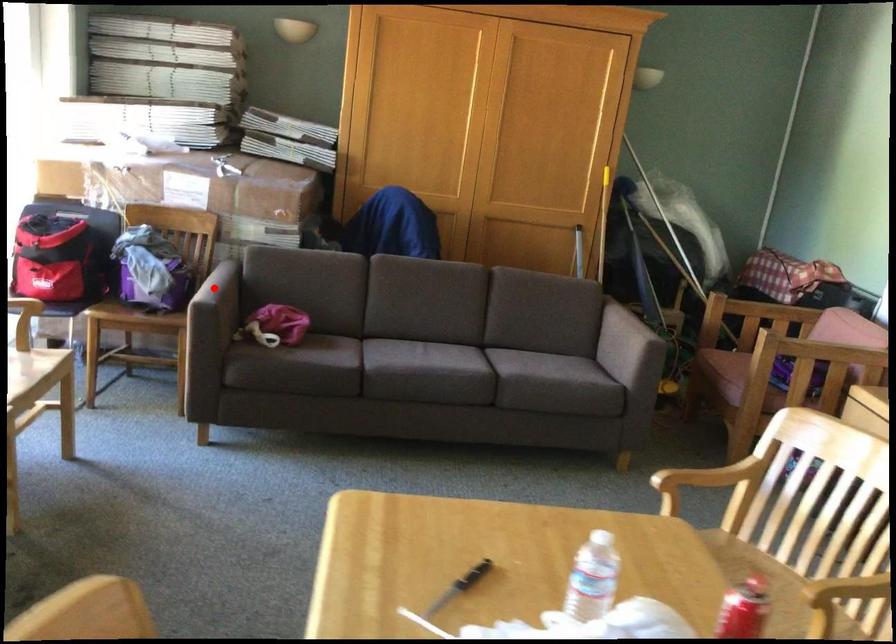
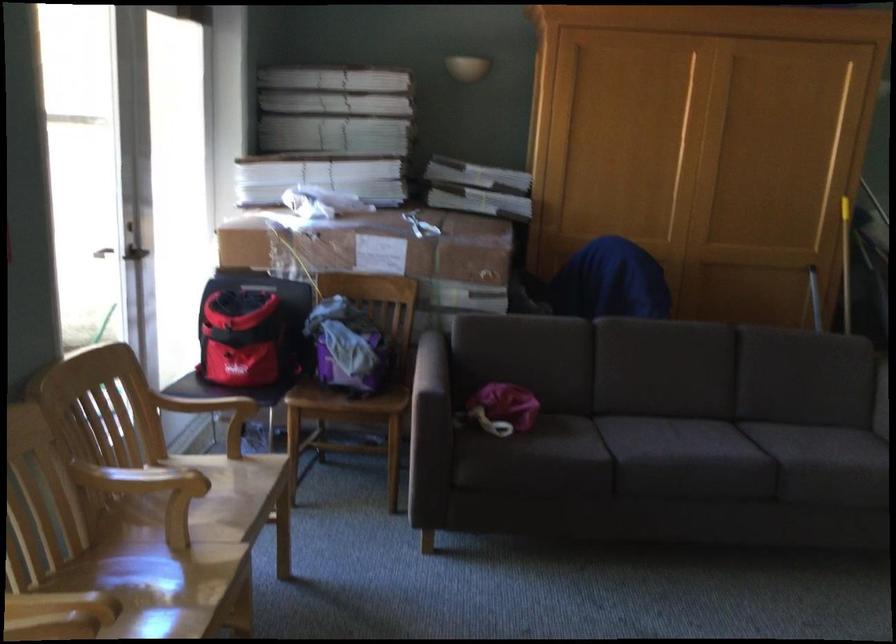
Where in the second image is the point corresponding to the highlighted location from the first image?

(431, 365)